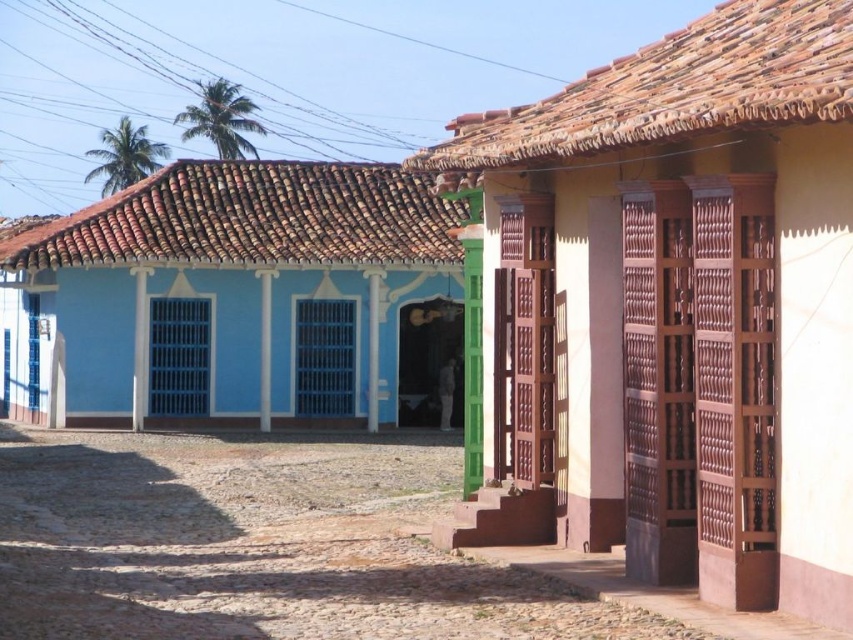
You are a delivery person standing at the entrance of the blue painted wood house at left and need to deliver a package to the matte brown wooden door at center. The delivery robot you are using has a maximum operating distance of 15 meters. Can the robot successfully deliver the package?

The matte brown wooden door at center is 14.13 meters from the blue painted wood house at left. Since the distance is within the robot s 15 meter limit, the robot can successfully deliver the package.